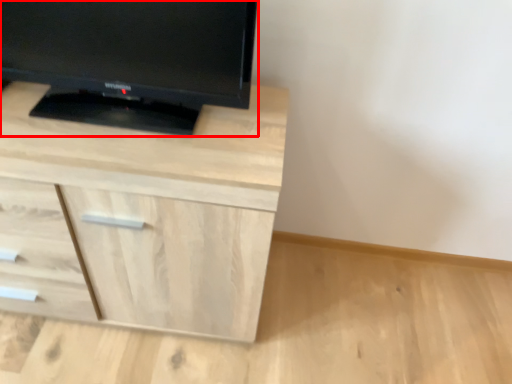
Question: In this image, where is television (annotated by the red box) located relative to chest of drawers?

Choices:
 (A) right
 (B) left

Answer: (A)